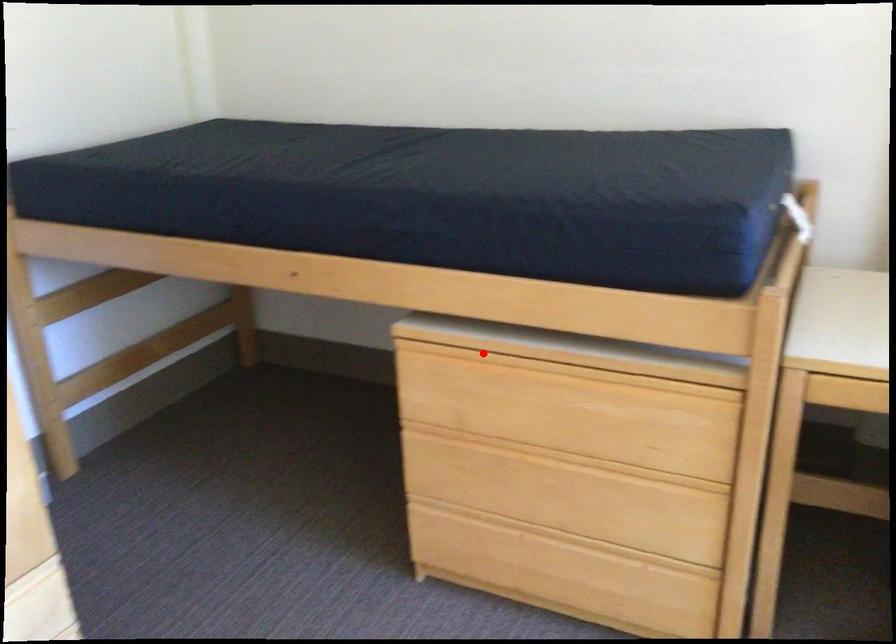
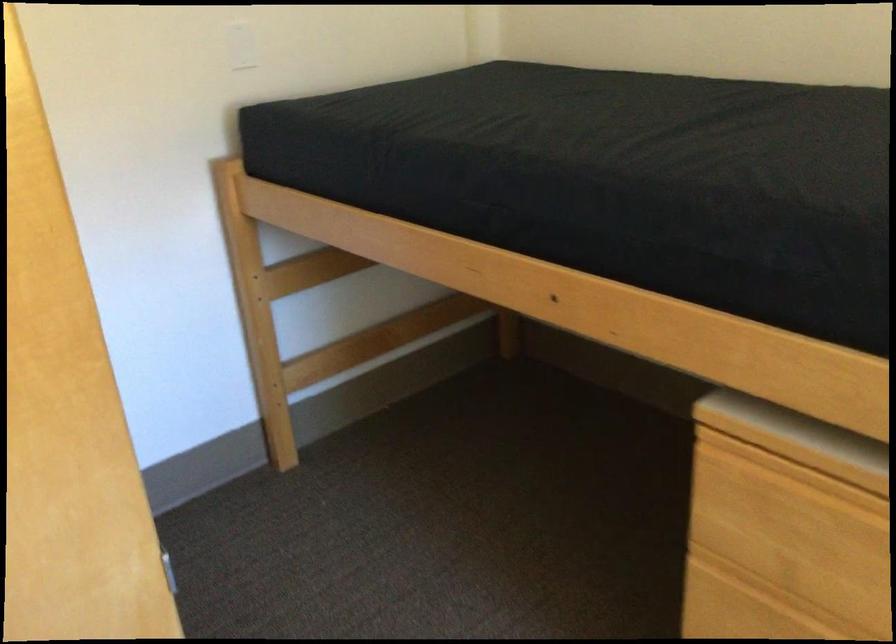
Question: I am providing you with two images of the same scene from different viewpoints. In image1, a red point is highlighted. Considering the same 3D point in image2, which of the following is correct?

Choices:
 (A) It is closer
 (B) It is farther

Answer: (A)